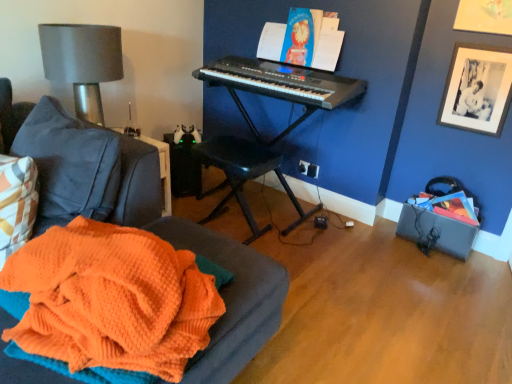
Find the location of a particular element. free point in front of black plastic keyboard at center is located at coordinates (314, 262).